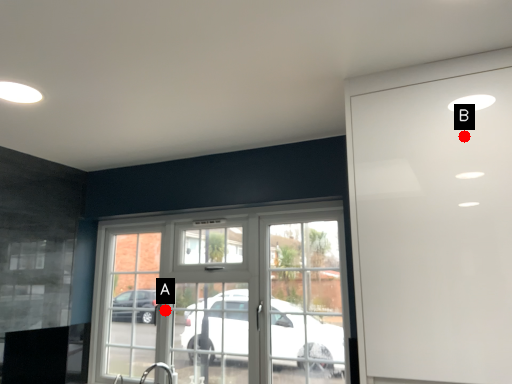
Question: Two points are circled on the image, labeled by A and B beside each circle. Which point appears closest to the camera in this image?

Choices:
 (A) A is closer
 (B) B is closer

Answer: (B)